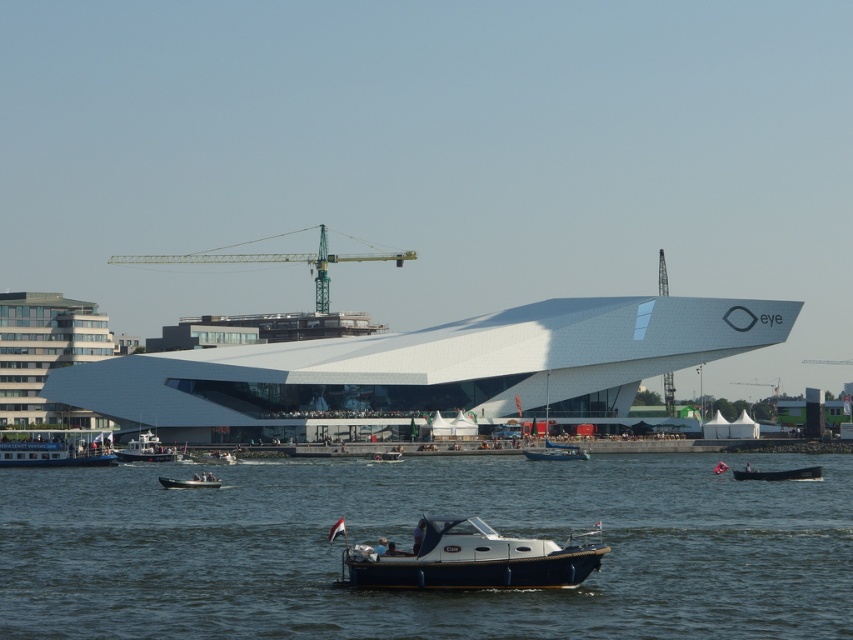
Question: Which point is closer to the camera taking this photo?

Choices:
 (A) (218, 486)
 (B) (126, 460)
 (C) (434, 499)

Answer: (C)

Question: Is transparent blue water at center thinner than blue polished wood boat at center?

Choices:
 (A) yes
 (B) no

Answer: (B)

Question: Estimate the real-world distances between objects in this image. Which object is closer to the green metallic crane at center?

Choices:
 (A) matte black boat at center
 (B) transparent blue water at center

Answer: (A)

Question: Where is transparent blue water at center located in relation to blue polished wood boat at center in the image?

Choices:
 (A) above
 (B) below

Answer: (B)

Question: Is transparent blue water at center wider than matte black boat at center?

Choices:
 (A) yes
 (B) no

Answer: (A)

Question: Which point appears closest to the camera in this image?

Choices:
 (A) (94, 432)
 (B) (509, 563)

Answer: (B)